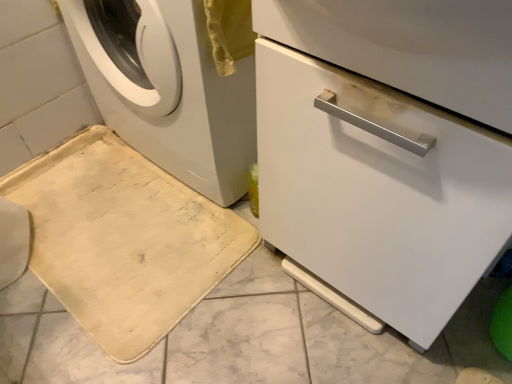
Question: Is beige fabric bath mat at lower left at the left side of white glossy dishwasher at center?

Choices:
 (A) yes
 (B) no

Answer: (A)

Question: Is beige fabric bath mat at lower left shorter than white glossy dishwasher at center?

Choices:
 (A) no
 (B) yes

Answer: (B)

Question: Would you say beige fabric bath mat at lower left contains white glossy dishwasher at center?

Choices:
 (A) no
 (B) yes

Answer: (A)

Question: Is beige fabric bath mat at lower left further to the viewer compared to white glossy dishwasher at center?

Choices:
 (A) no
 (B) yes

Answer: (B)

Question: From the image's perspective, would you say beige fabric bath mat at lower left is positioned over white glossy dishwasher at center?

Choices:
 (A) yes
 (B) no

Answer: (B)

Question: Is beige fabric bath mat at lower left at the right side of white glossy dishwasher at center?

Choices:
 (A) yes
 (B) no

Answer: (B)

Question: From the image's perspective, does beige fabric bath mat at lower left appear lower than white matte washing machine at left?

Choices:
 (A) yes
 (B) no

Answer: (A)

Question: Considering the relative sizes of beige fabric bath mat at lower left and white matte washing machine at left in the image provided, is beige fabric bath mat at lower left thinner than white matte washing machine at left?

Choices:
 (A) no
 (B) yes

Answer: (A)

Question: Can you confirm if beige fabric bath mat at lower left is smaller than white matte washing machine at left?

Choices:
 (A) no
 (B) yes

Answer: (B)

Question: Is the surface of beige fabric bath mat at lower left in direct contact with white matte washing machine at left?

Choices:
 (A) yes
 (B) no

Answer: (B)

Question: Can you confirm if beige fabric bath mat at lower left is bigger than white matte washing machine at left?

Choices:
 (A) no
 (B) yes

Answer: (A)

Question: Considering the relative positions of beige fabric bath mat at lower left and white matte washing machine at left in the image provided, is beige fabric bath mat at lower left to the left of white matte washing machine at left from the viewer's perspective?

Choices:
 (A) no
 (B) yes

Answer: (B)

Question: Is beige fabric bath mat at lower left surrounded by white matte washing machine at left?

Choices:
 (A) yes
 (B) no

Answer: (B)